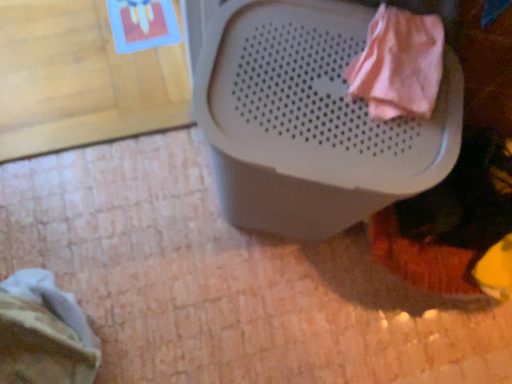
The image size is (512, 384). Identify the location of vacant area situated to the left side of pink fabric at upper right, which is the 1th clothing from top to bottom. (292, 62).